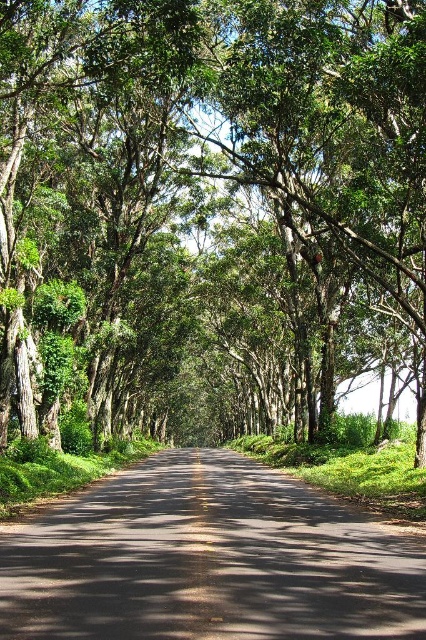
You are standing at the center of the road and see a point marked at coordinates (207, 211). What object is located at that point?

The green leafy tree at center is located at point (207, 211).

You are standing at the starting point of the road and want to reach the green leafy tree at center. Which direction should you walk to get there?

The green leafy tree at center is located at point (207, 211), so you should walk forward along the road towards the center to reach it.